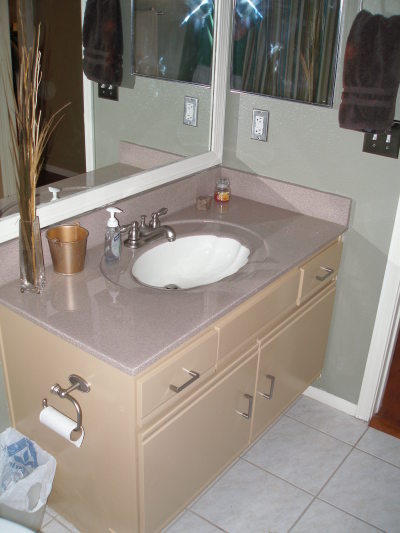
Identify the location of toilet tissue. (63, 414), (60, 428).